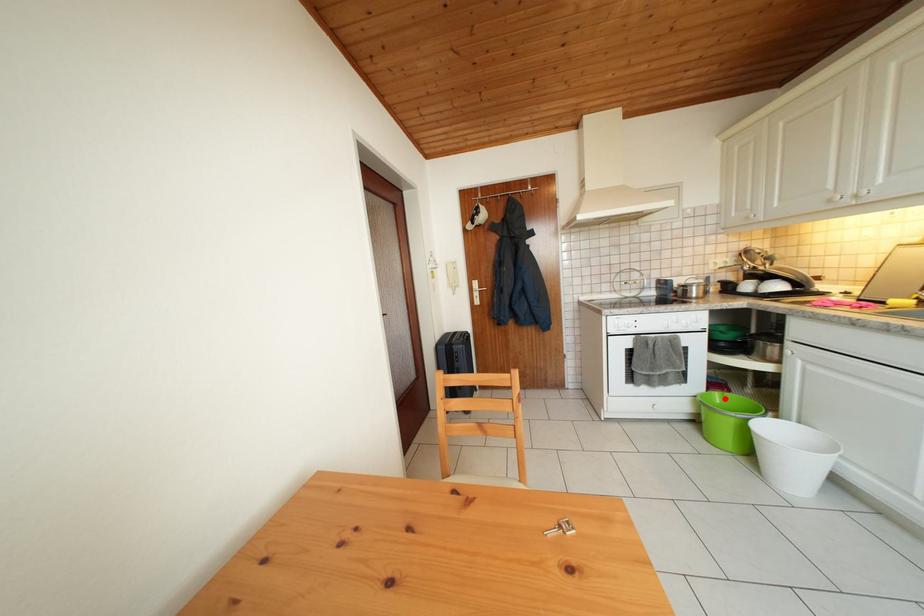
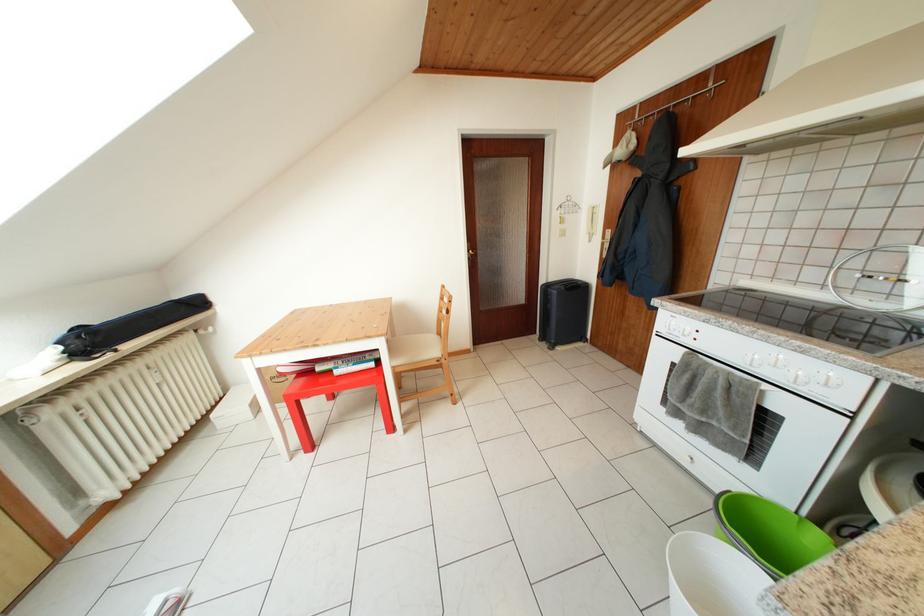
Question: I am providing you with two images of the same scene from different viewpoints. Image1 has a red point marked. In image2, the corresponding 3D location appears at what relative position? Reply with the corresponding letter.

Choices:
 (A) Closer
 (B) Farther

Answer: (B)